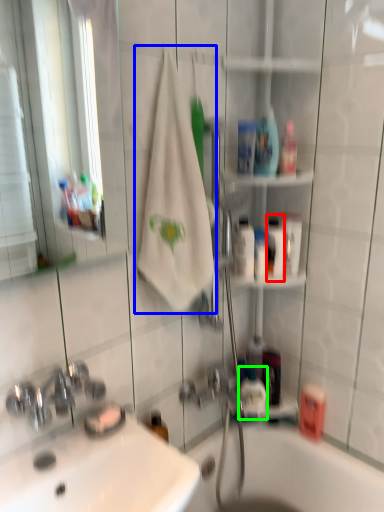
Question: Which object is the farthest from mouthwash (highlighted by a red box)? Choose among these: bath towel (highlighted by a blue box) or mouthwash (highlighted by a green box).

Choices:
 (A) bath towel
 (B) mouthwash

Answer: (B)